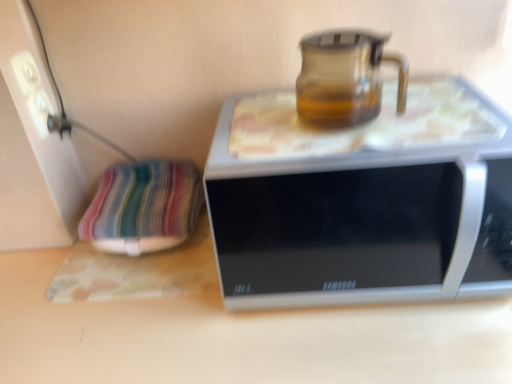
Identify the location of free space to the left of transparent glass jug at upper center. (257, 142).